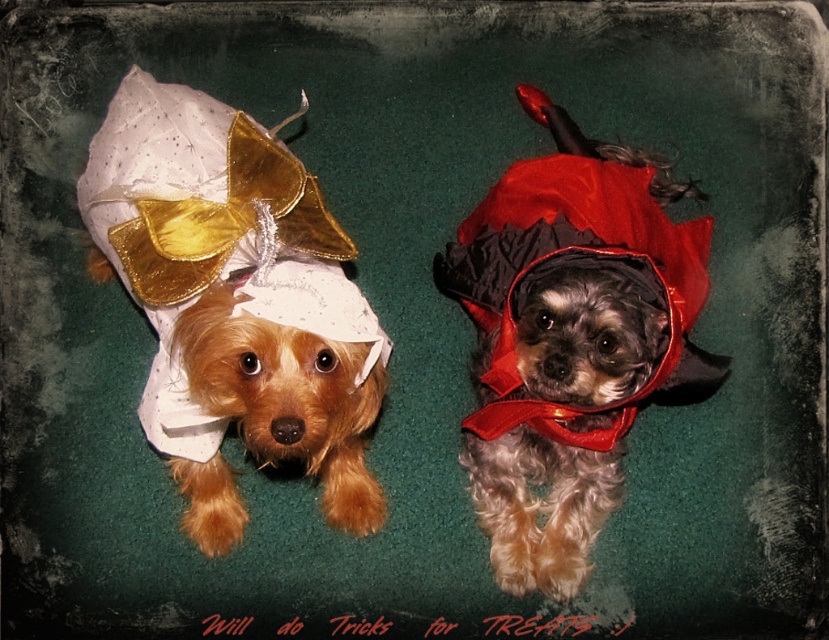
You are a photographer holding a camera and want to take a photo of the shiny white dress at upper left. If you are standing 1.5 meters away from the dress, will you be able to focus on it clearly?

The shiny white dress at upper left and camera are 1.42 meters apart from each other. Since you are standing 1.5 meters away, which is slightly farther than the required distance, you might have difficulty focusing clearly. Adjust your position to be closer to ensure sharpness.

You are a photographer setting up for a pet photoshoot. You have a 1.2 meter wide backdrop stand that needs to accommodate both the shiny white dress at upper left and the velvet red cape at center. Based on their widths, will the combined width of both items exceed the backdrop stand?

The shiny white dress at upper left might be wider than velvet red cape at center, so the combined width could potentially exceed the 1.2 meter backdrop stand. It is advisable to measure both items individually to ensure they fit together.